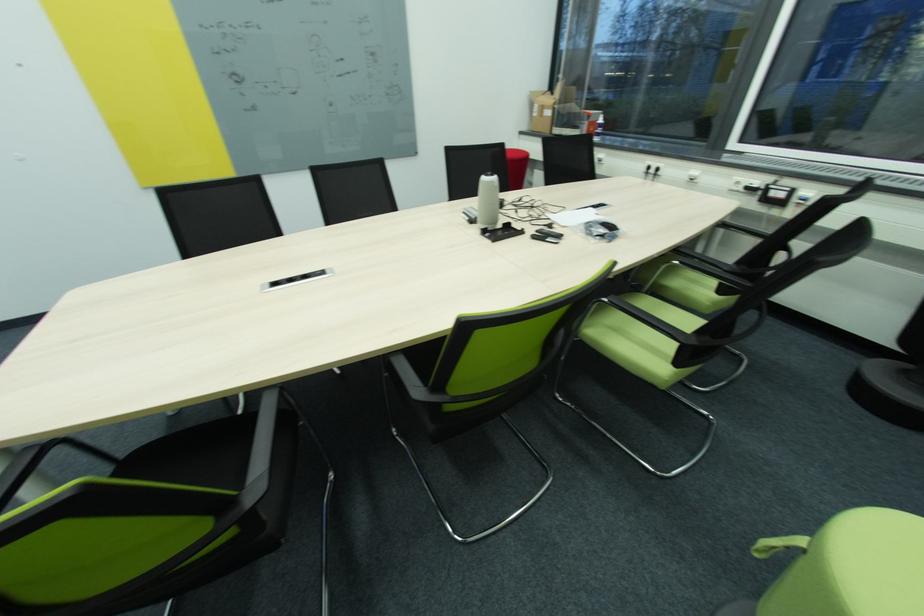
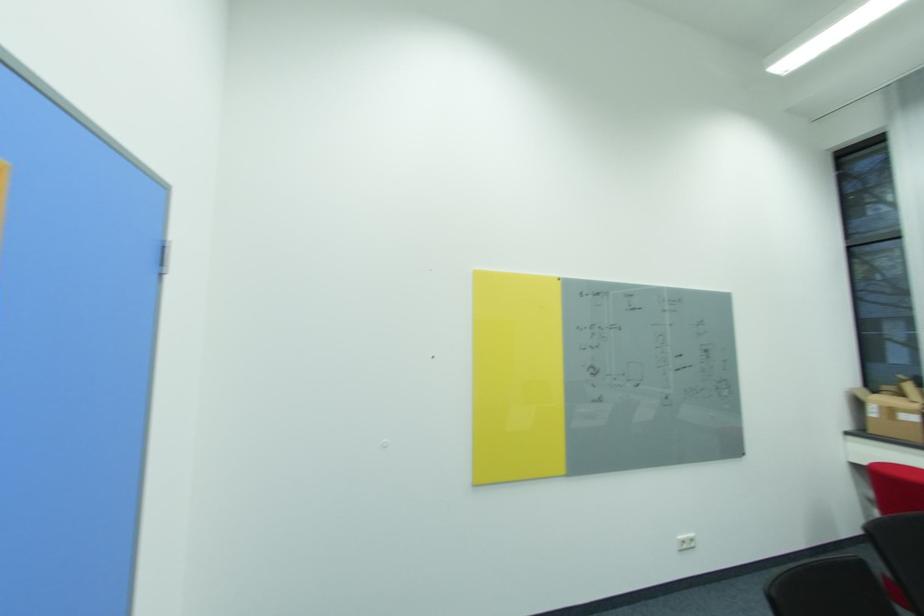
The point at (x=545, y=110) is marked in the first image. Where is the corresponding point in the second image?

(895, 411)